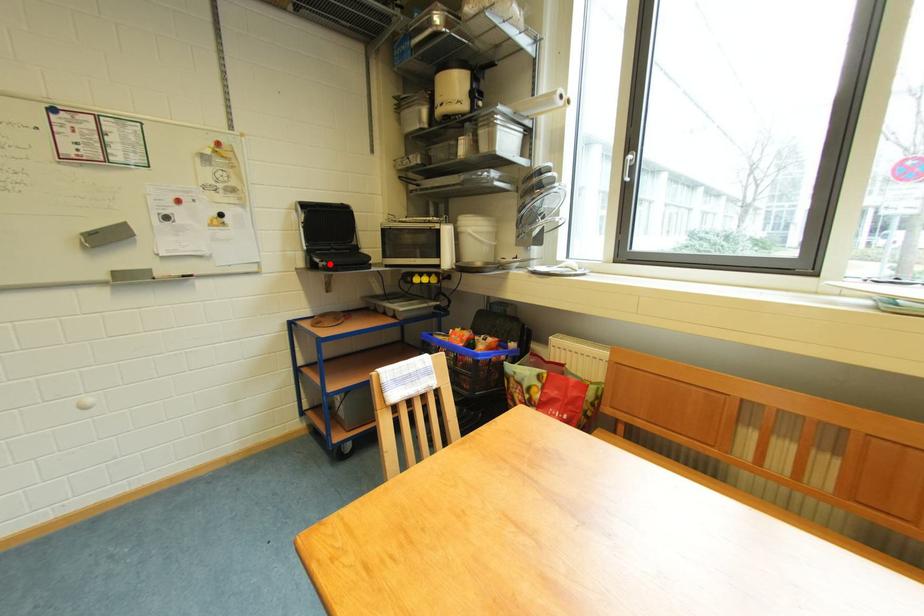
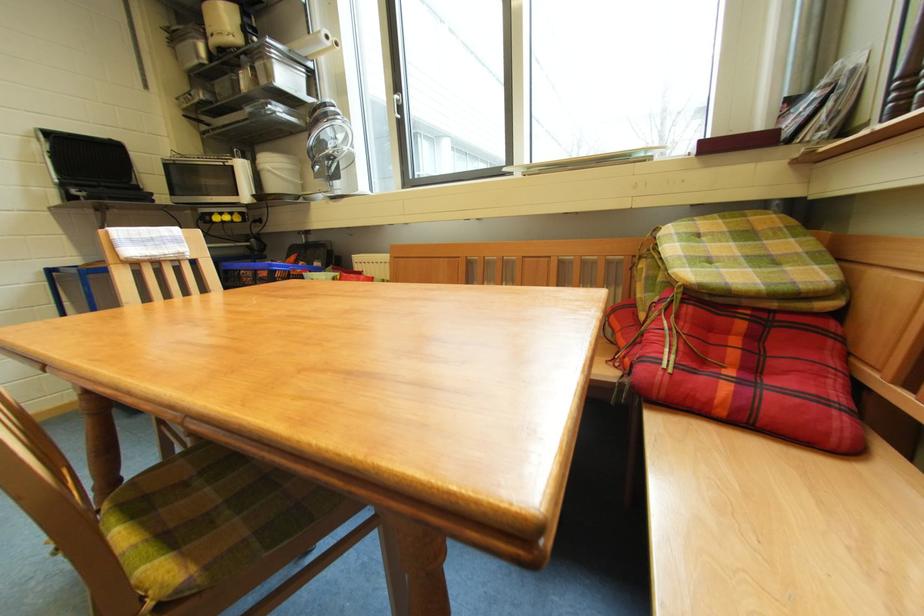
Question: I am providing you with two images of the same scene from different viewpoints. Given a red point in image1, look at the same physical point in image2. Is it:

Choices:
 (A) Closer to the viewpoint
 (B) Farther from the viewpoint

Answer: (B)